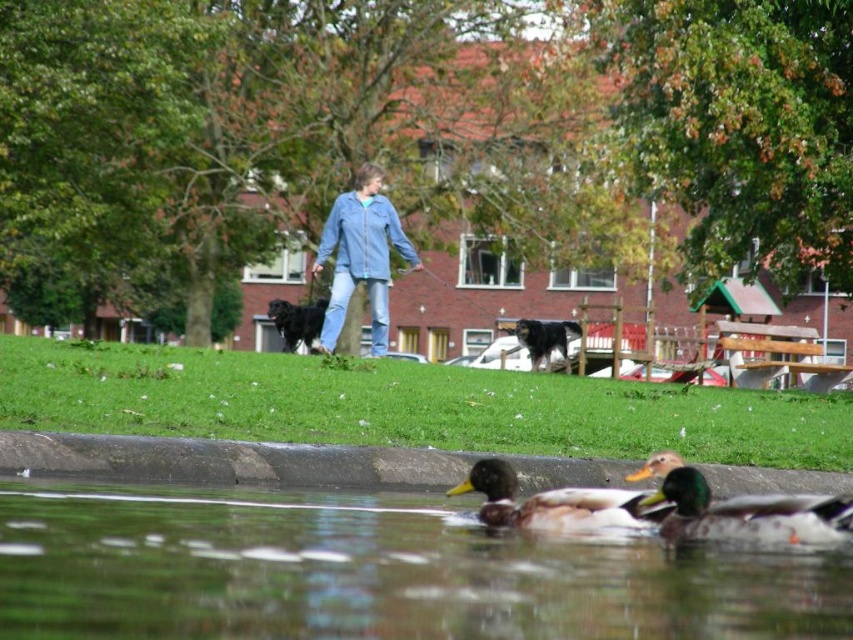
You are a photographer trying to capture a clear shot of the green glossy duck at lower center without any obstructions. The denim jacket at center is currently blocking your view. Can you adjust your position to take the photo without moving the jacket?

The green glossy duck at lower center is positioned under the denim jacket at center, so adjusting your position to take the photo without moving the jacket may be possible by moving to a lower angle or shifting sideways to avoid the jacket blocking the view.

You are standing in the park and see the black matte dog at center and the black shaggy dog at center. Which dog is closer to you?

The black matte dog at center is closer to you because it is in front of the black shaggy dog at center.